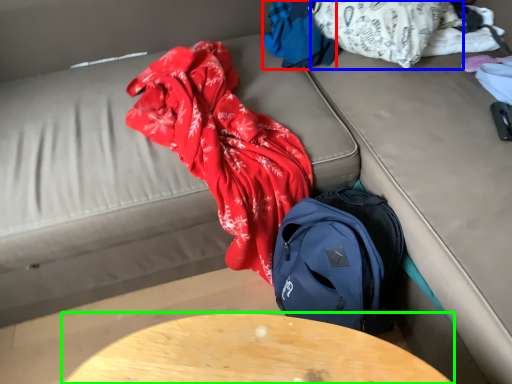
Question: Which object is the closest to the clothing (highlighted by a red box)? Choose among these: clothing (highlighted by a blue box) or table (highlighted by a green box).

Choices:
 (A) clothing
 (B) table

Answer: (A)